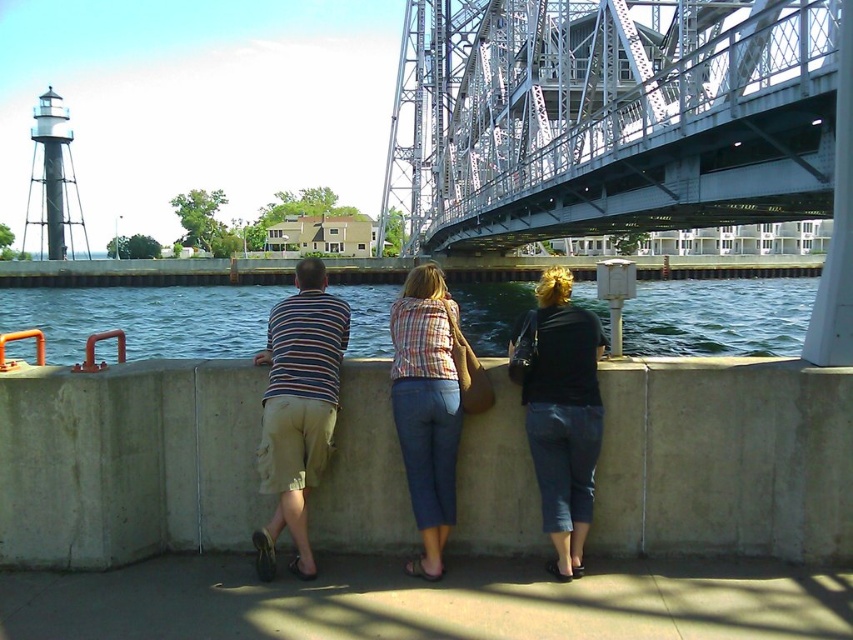
Is blue water at center shorter than plaid shirt at center?

Incorrect, blue water at center's height does not fall short of plaid shirt at center's.

Is blue water at center thinner than plaid shirt at center?

No.

Which is behind, point (579, 284) or point (422, 512)?

The point (579, 284) is more distant.

At what (x,y) coordinates should I click in order to perform the action: click on blue water at center. Please return your answer as a coordinate pair (x, y). This screenshot has height=640, width=853. Looking at the image, I should click on (144, 317).

Identify the location of blue water at center. (144, 317).

Does point (0, 320) lie behind point (316, 289)?

Yes, it is.

Locate an element on the screen. The height and width of the screenshot is (640, 853). blue water at center is located at coordinates (144, 317).

Between blue water at center and black denim jeans at center, which one has less height?

With less height is black denim jeans at center.

Is point (469, 321) more distant than point (570, 506)?

Yes, it is.

Who is more forward, (671, 300) or (583, 372)?

Point (583, 372)

I want to click on blue water at center, so click(x=144, y=317).